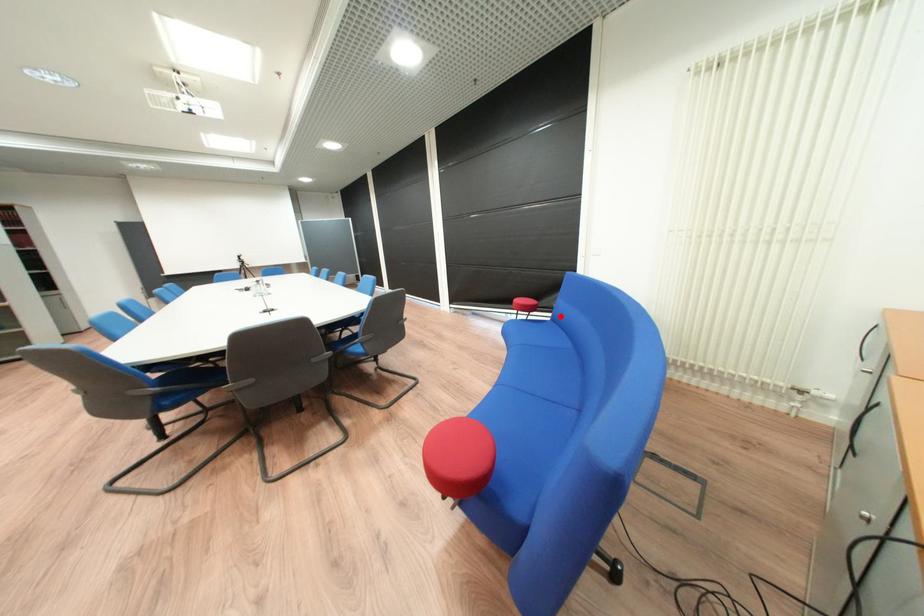
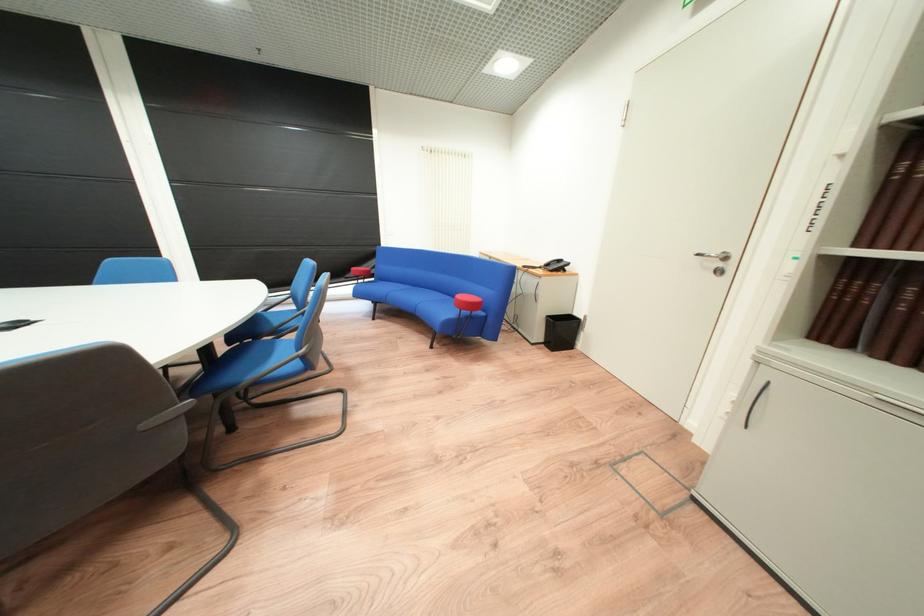
Question: I am providing you with two images of the same scene from different viewpoints. Given a red point in image1, look at the same physical point in image2. Is it:

Choices:
 (A) Closer to the viewpoint
 (B) Farther from the viewpoint

Answer: (A)